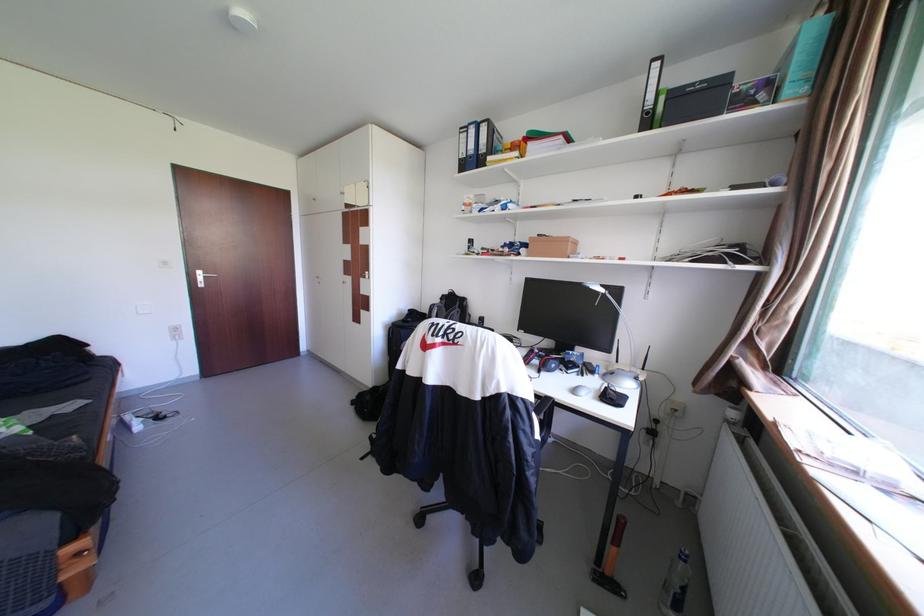
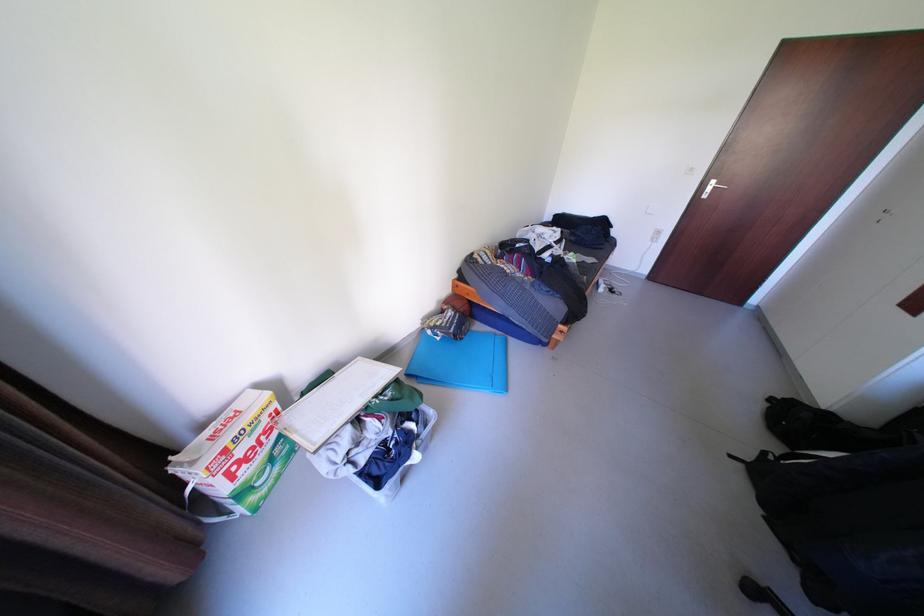
First-person continuous shooting, in which direction is the camera rotating?

The rotation direction of the camera is left-down.